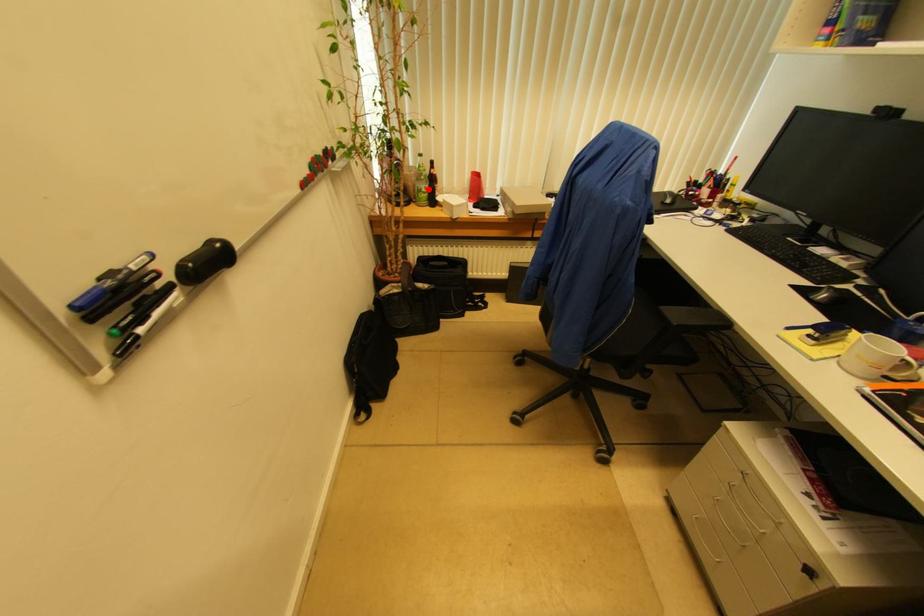
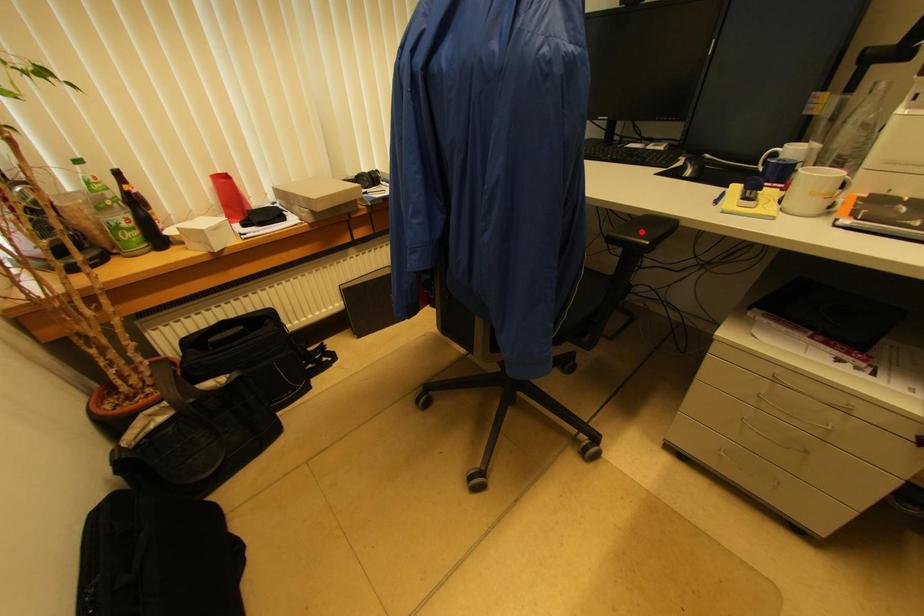
I am providing you with two images of the same scene from different viewpoints. A red point is marked on the first image and another point is marked on the second image. Does the point marked in image1 correspond to the same location as the one in image2?

No